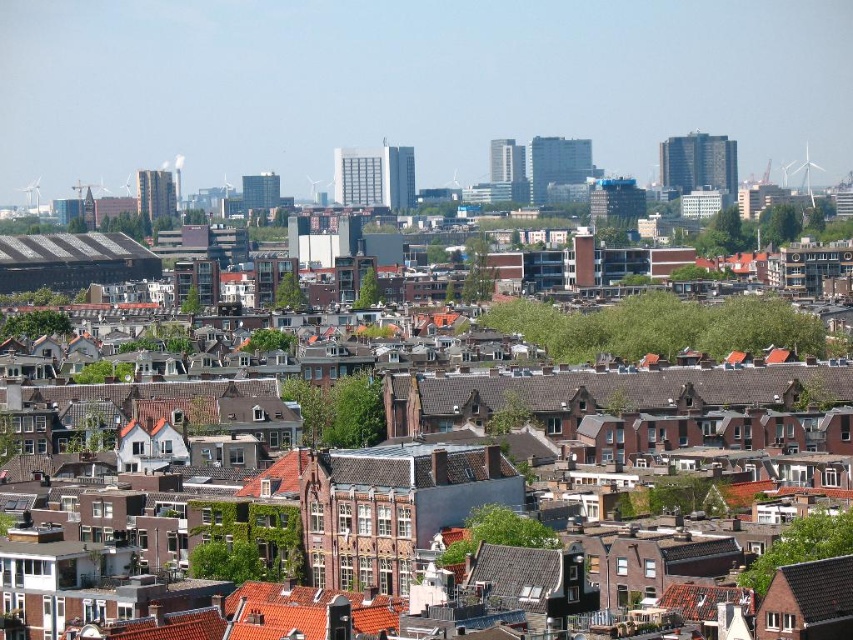
Question: Is white plastic wind turbine at upper right positioned at the back of white plastic wind turbine at upper left?

Choices:
 (A) no
 (B) yes

Answer: (A)

Question: Estimate the real-world distances between objects in this image. Which object is closer to the white plastic wind turbine at upper left?

Choices:
 (A) white plastic wind turbine at upper right
 (B) white plastic wind turbine at center

Answer: (B)

Question: Considering the relative positions of white plastic wind turbine at center and white plastic wind turbine at upper left in the image provided, where is white plastic wind turbine at center located with respect to white plastic wind turbine at upper left?

Choices:
 (A) left
 (B) right

Answer: (B)

Question: Which object is closer to the camera taking this photo?

Choices:
 (A) white plastic wind turbine at center
 (B) white plastic wind turbine at upper right
 (C) white plastic wind turbine at upper left

Answer: (B)

Question: Among these objects, which one is nearest to the camera?

Choices:
 (A) white plastic wind turbine at center
 (B) white plastic wind turbine at upper left
 (C) white plastic wind turbine at upper right

Answer: (C)

Question: Where is white plastic wind turbine at upper right located in relation to white plastic wind turbine at upper left in the image?

Choices:
 (A) right
 (B) left

Answer: (A)